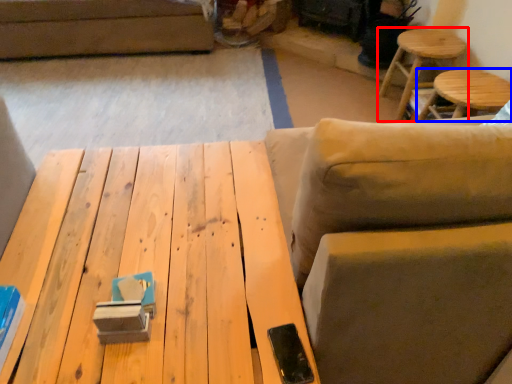
Question: Among these objects, which one is farthest to the camera, stool (highlighted by a red box) or stool (highlighted by a blue box)?

Choices:
 (A) stool
 (B) stool

Answer: (A)